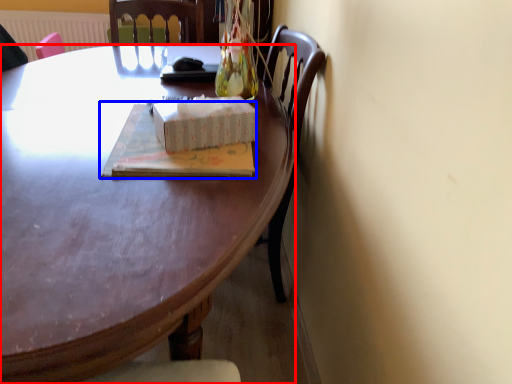
Question: Which object appears closest to the camera in this image, desk (highlighted by a red box) or book (highlighted by a blue box)?

Choices:
 (A) desk
 (B) book

Answer: (A)